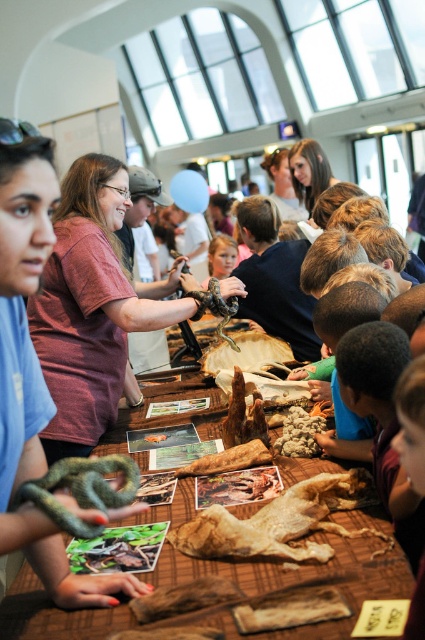
Does green scaly snake at lower left appear under brown crumbly bread at center?

No, green scaly snake at lower left is not below brown crumbly bread at center.

Can you confirm if green scaly snake at lower left is wider than brown crumbly bread at center?

Yes, green scaly snake at lower left is wider than brown crumbly bread at center.

The height and width of the screenshot is (640, 425). What are the coordinates of `green scaly snake at lower left` in the screenshot? It's located at (81, 490).

Does brown crumbly bread at center have a smaller size compared to brown leather table at center?

Indeed, brown crumbly bread at center has a smaller size compared to brown leather table at center.

Who is shorter, brown crumbly bread at center or brown leather table at center?

brown crumbly bread at center

Identify the location of brown crumbly bread at center. The image size is (425, 640). (300, 433).

Who is more distant from viewer, (127, 483) or (112, 589)?

The point (112, 589) is behind.

Does point (56, 515) come in front of point (113, 586)?

Yes, point (56, 515) is closer to viewer.

You are a GUI agent. You are given a task and a screenshot of the screen. Output one action in this format:
    pyautogui.click(x=<x>, y=<y>)
    Task: Click on the green scaly snake at lower left
    
    Given the screenshot: What is the action you would take?
    81,490